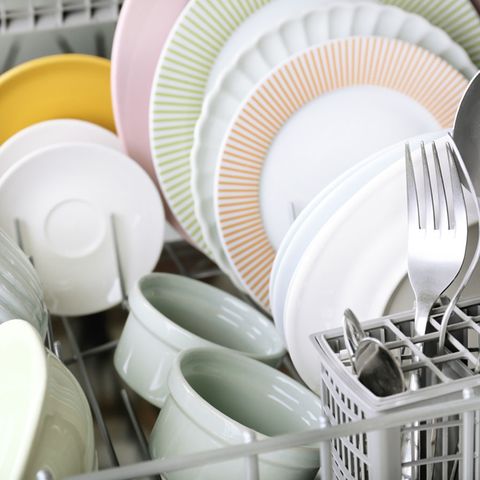
Find the location of a particular element. Image resolution: width=480 pixels, height=480 pixels. plain white dishes is located at coordinates (54, 425), (170, 403), (151, 354), (47, 213), (41, 134), (224, 95), (305, 205), (316, 217), (332, 239).